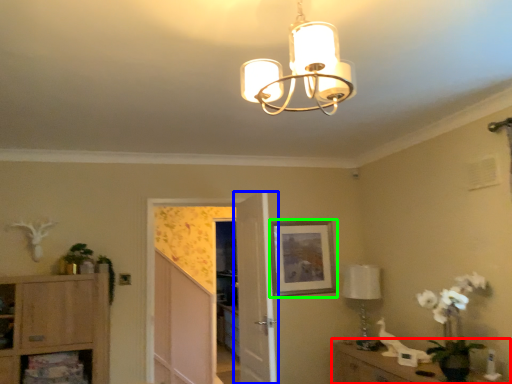
Question: Based on their relative distances, which object is farther from vanity (highlighted by a red box)? Choose from door (highlighted by a blue box) and picture frame (highlighted by a green box).

Choices:
 (A) door
 (B) picture frame

Answer: (A)